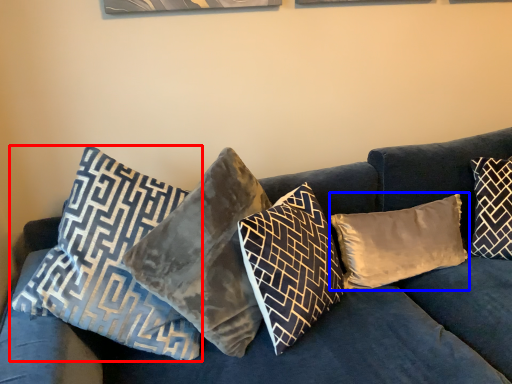
Question: Which of the following is the closest to the observer, pillow (highlighted by a red box) or pillow (highlighted by a blue box)?

Choices:
 (A) pillow
 (B) pillow

Answer: (A)